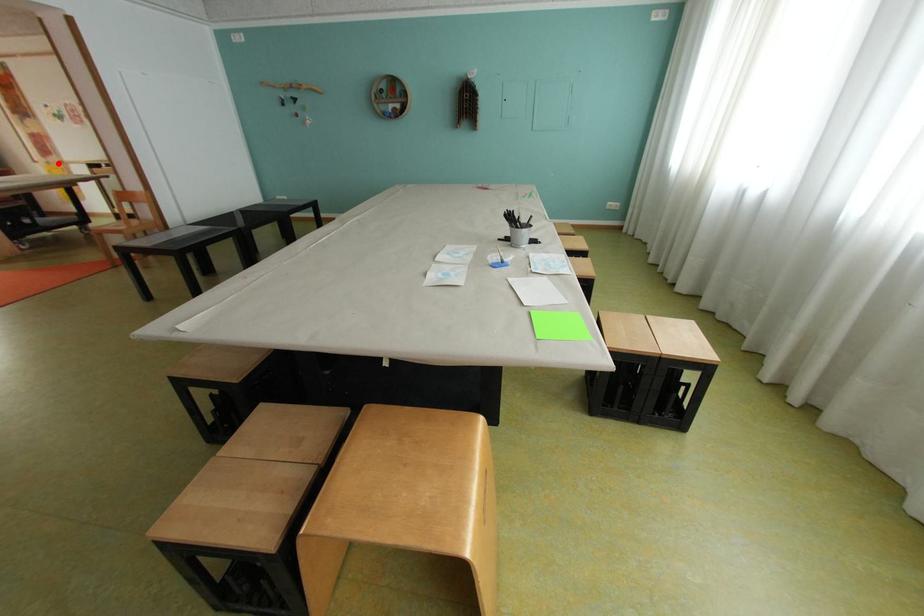
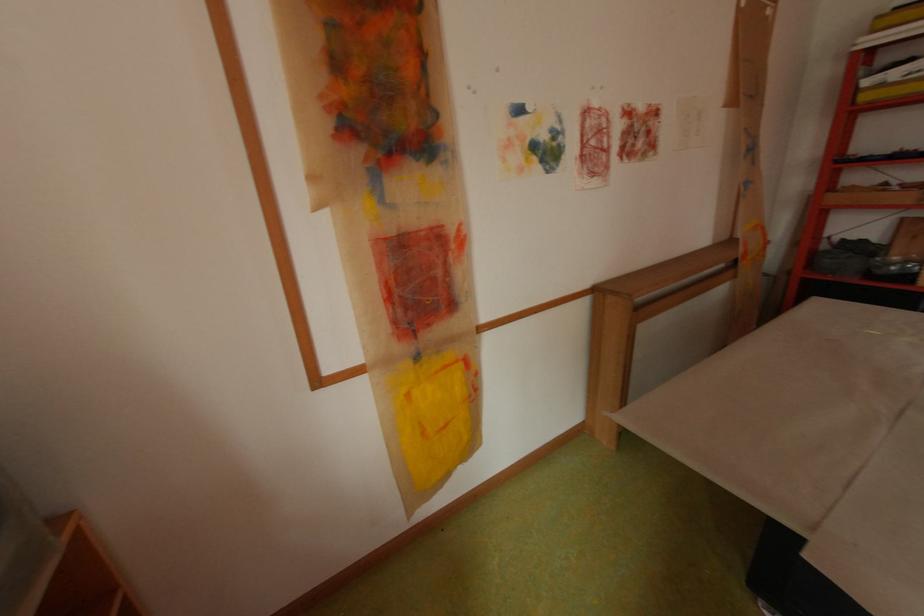
Question: I am providing you with two images of the same scene from different viewpoints. Given a red point in image1, look at the same physical point in image2. Is it:

Choices:
 (A) Closer to the viewpoint
 (B) Farther from the viewpoint

Answer: (A)